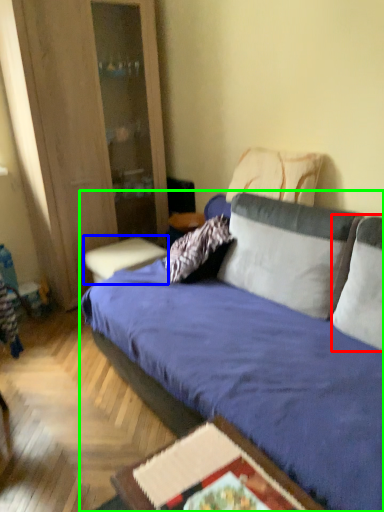
Question: Which object is the closest to the pillow (highlighted by a red box)? Choose among these: table (highlighted by a blue box) or studio couch (highlighted by a green box).

Choices:
 (A) table
 (B) studio couch

Answer: (B)